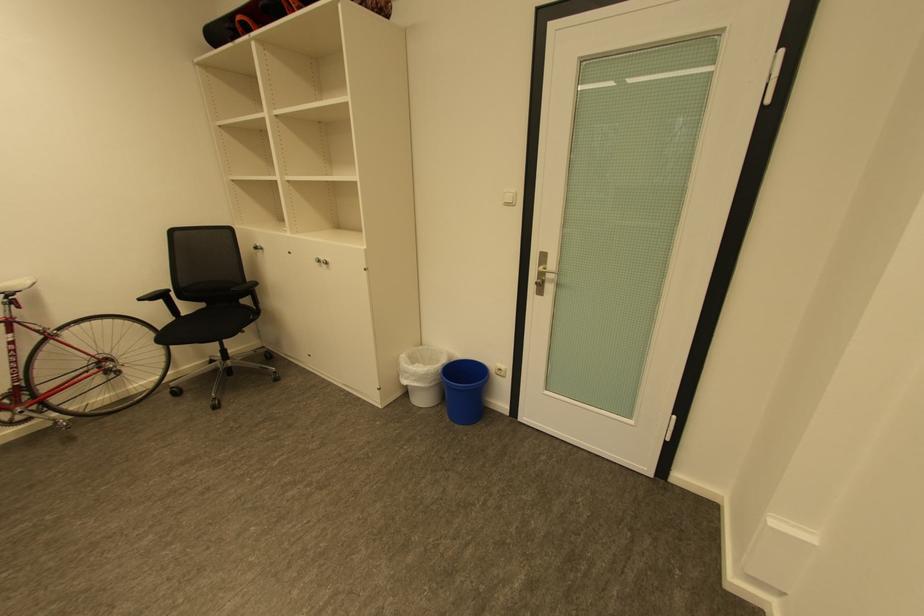
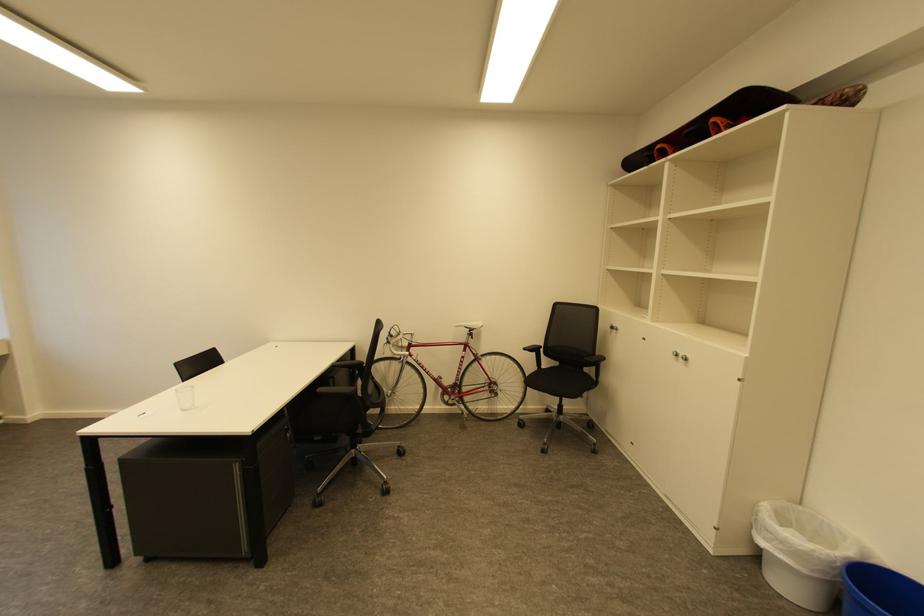
Where in the second image is the point corresponding to point (414, 373) from the first image?

(775, 533)